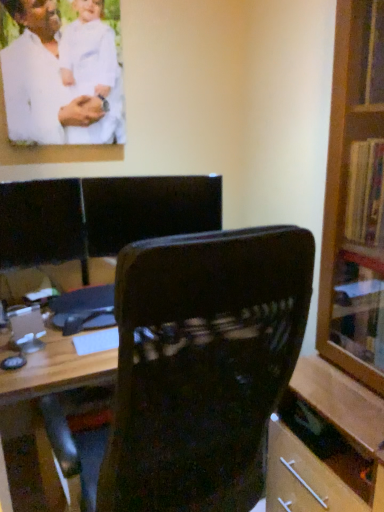
Question: Is black leather chair at center turned away from wooden bookcase at right?

Choices:
 (A) no
 (B) yes

Answer: (A)

Question: Can you confirm if black leather chair at center is smaller than wooden bookcase at right?

Choices:
 (A) yes
 (B) no

Answer: (A)

Question: Considering the relative positions of black leather chair at center and wooden bookcase at right in the image provided, is black leather chair at center to the left of wooden bookcase at right from the viewer's perspective?

Choices:
 (A) yes
 (B) no

Answer: (A)

Question: Would you say black leather chair at center is outside wooden bookcase at right?

Choices:
 (A) no
 (B) yes

Answer: (B)

Question: Is black leather chair at center shorter than wooden bookcase at right?

Choices:
 (A) yes
 (B) no

Answer: (A)

Question: From the image's perspective, is black leather chair at center on wooden bookcase at right?

Choices:
 (A) no
 (B) yes

Answer: (B)

Question: Considering the relative sizes of black leather chair at center and velvet-like dark brown chair at center in the image provided, is black leather chair at center shorter than velvet-like dark brown chair at center?

Choices:
 (A) yes
 (B) no

Answer: (A)

Question: Could you tell me if black leather chair at center is facing velvet-like dark brown chair at center?

Choices:
 (A) yes
 (B) no

Answer: (A)

Question: Considering the relative sizes of black leather chair at center and velvet-like dark brown chair at center in the image provided, is black leather chair at center bigger than velvet-like dark brown chair at center?

Choices:
 (A) yes
 (B) no

Answer: (B)

Question: From the image's perspective, is black leather chair at center above velvet-like dark brown chair at center?

Choices:
 (A) no
 (B) yes

Answer: (B)

Question: Is black leather chair at center in front of velvet-like dark brown chair at center?

Choices:
 (A) yes
 (B) no

Answer: (B)

Question: Considering the relative positions of black leather chair at center and velvet-like dark brown chair at center in the image provided, is black leather chair at center to the right of velvet-like dark brown chair at center from the viewer's perspective?

Choices:
 (A) no
 (B) yes

Answer: (A)

Question: Is white matte shirt at upper left oriented away from velvet-like dark brown chair at center?

Choices:
 (A) no
 (B) yes

Answer: (A)